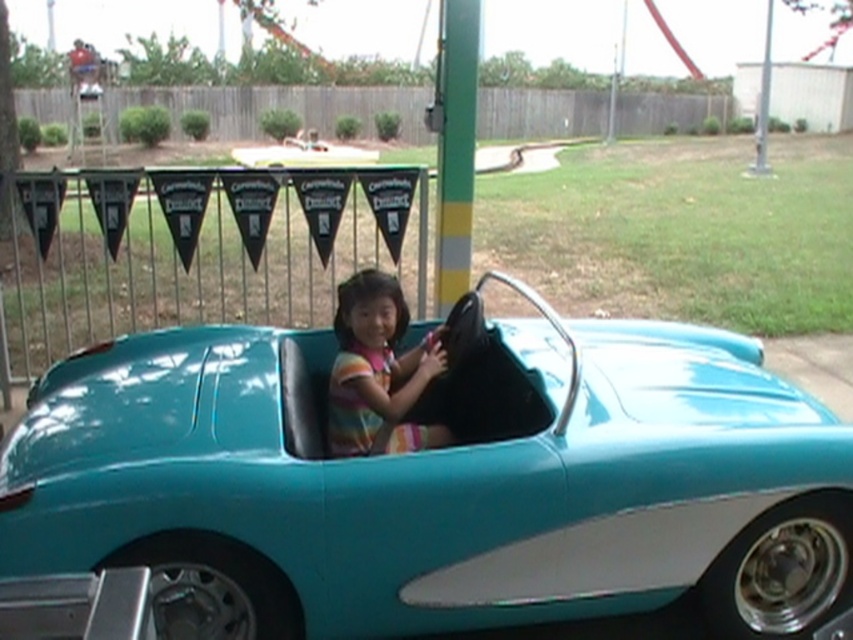
Does teal glossy car at center have a lesser height compared to striped fabric child at center?

No, teal glossy car at center is not shorter than striped fabric child at center.

Which is above, teal glossy car at center or striped fabric child at center?

striped fabric child at center

Is point (233, 404) positioned in front of point (347, 433)?

Yes, point (233, 404) is in front of point (347, 433).

Identify the location of teal glossy car at center. This screenshot has height=640, width=853. (419, 483).